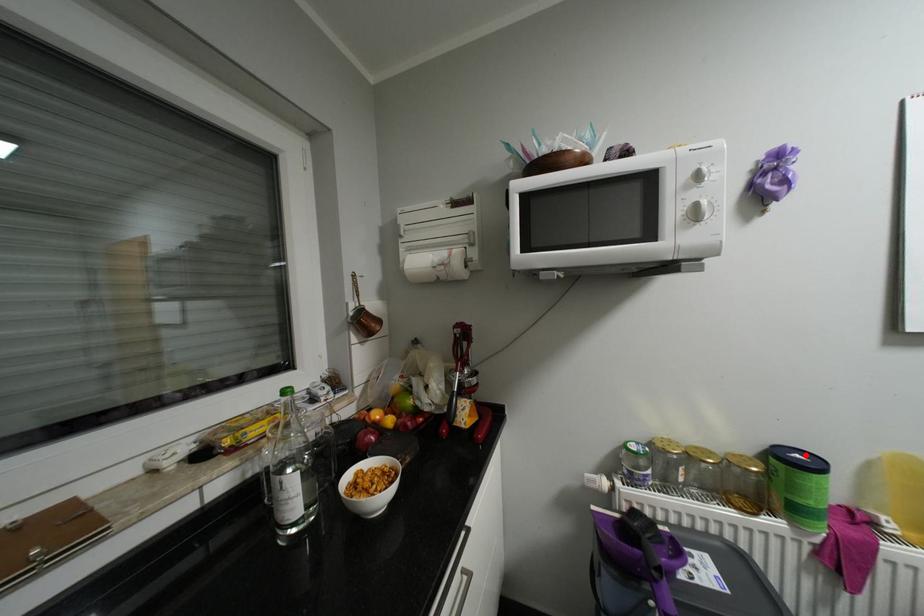
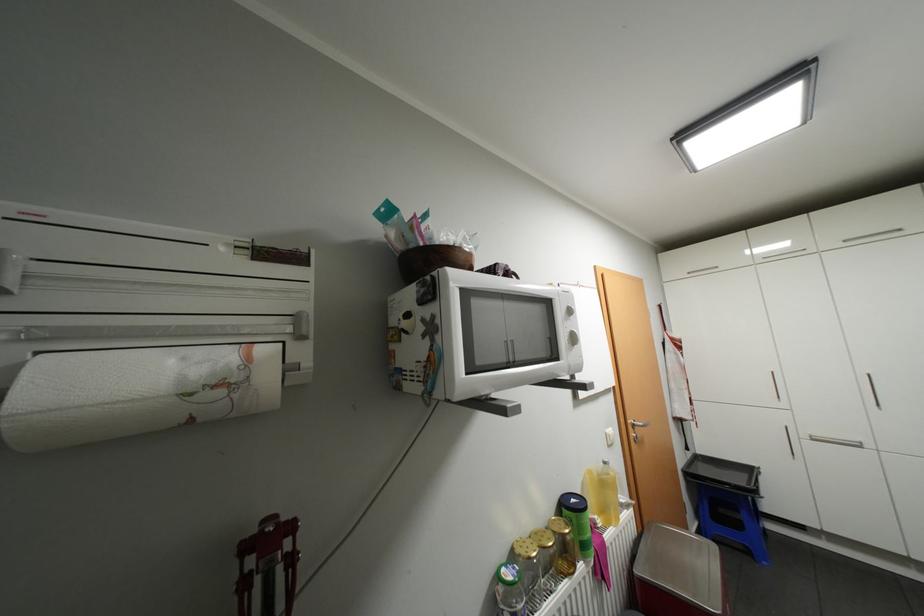
The point at the highlighted location is marked in the first image. Where is the corresponding point in the second image?

(580, 499)